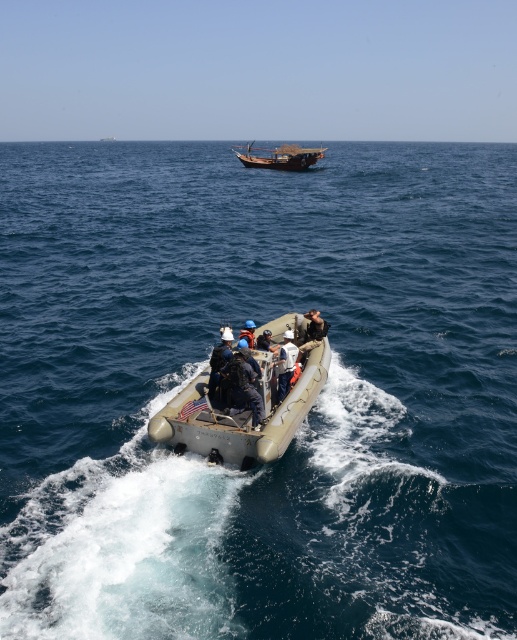
Question: Which point appears closest to the camera in this image?

Choices:
 (A) (278, 161)
 (B) (321, 339)
 (C) (284, 348)
 (D) (275, 339)

Answer: (C)

Question: Does wooden sailboat at center appear on the left side of dark brown leather jacket at center?

Choices:
 (A) yes
 (B) no

Answer: (A)

Question: Which point is farther to the camera?

Choices:
 (A) wooden sailboat at center
 (B) beige rubber dinghy at center

Answer: (A)

Question: Which of these objects is positioned closest to the beige rubber dinghy at center?

Choices:
 (A) dark gray rubber boat at center
 (B) wooden sailboat at center

Answer: (A)

Question: Does wooden sailboat at center appear over dark brown leather jacket at center?

Choices:
 (A) yes
 (B) no

Answer: (A)

Question: From the image, what is the correct spatial relationship of dark gray rubber boat at center in relation to light gray fabric jacket at center?

Choices:
 (A) left
 (B) right

Answer: (B)